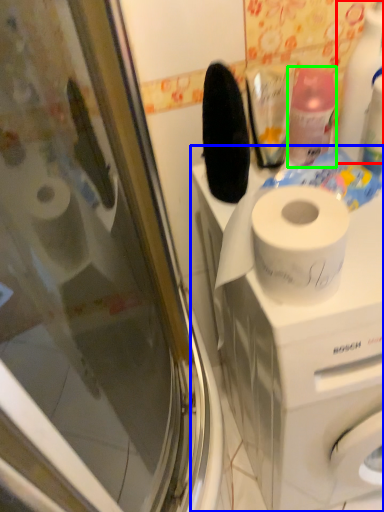
Question: Considering the real-world distances, which object is farthest from cleaning product (highlighted by a red box)? washing machine (highlighted by a blue box) or cleaning product (highlighted by a green box)?

Choices:
 (A) washing machine
 (B) cleaning product

Answer: (A)